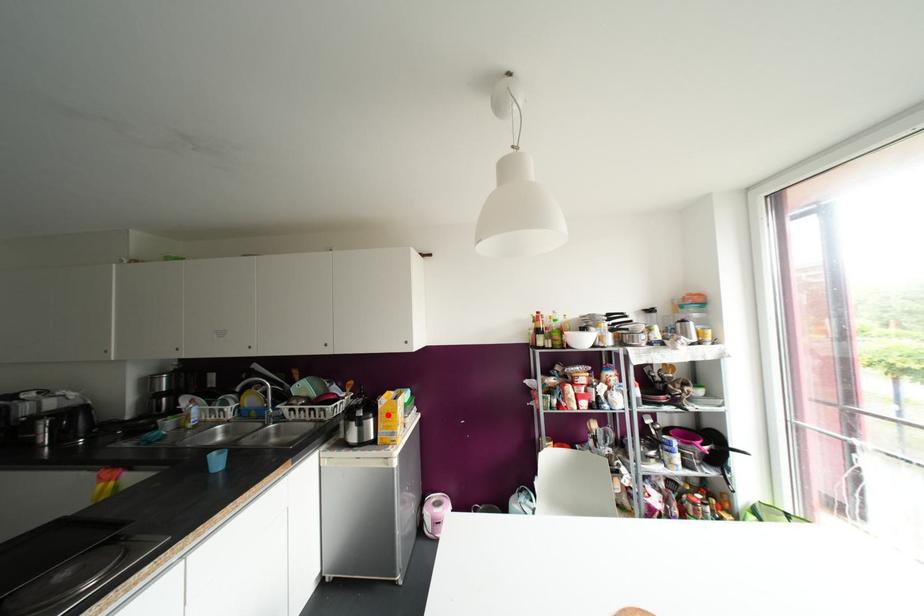
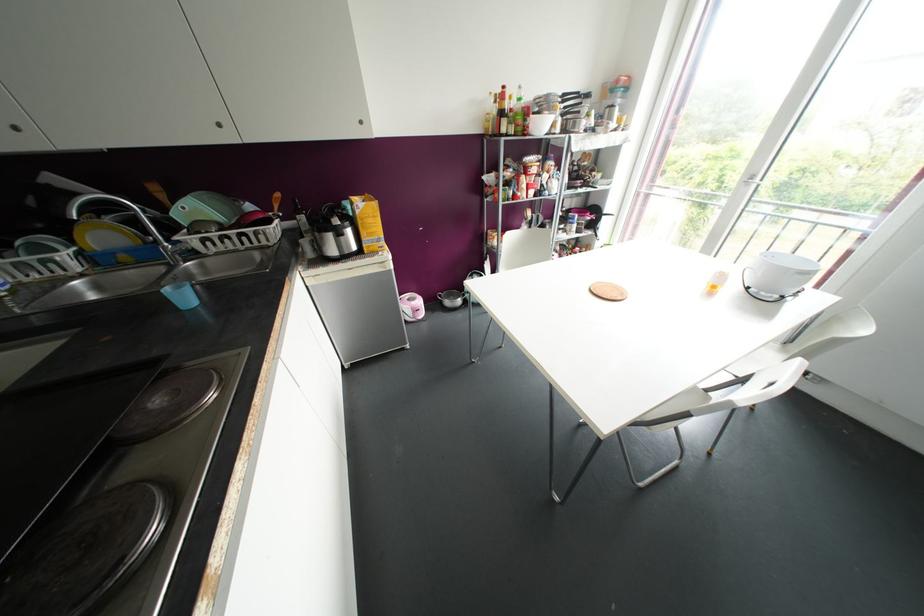
Locate, in the second image, the point that corresponds to the highlighted location in the first image.

(370, 220)